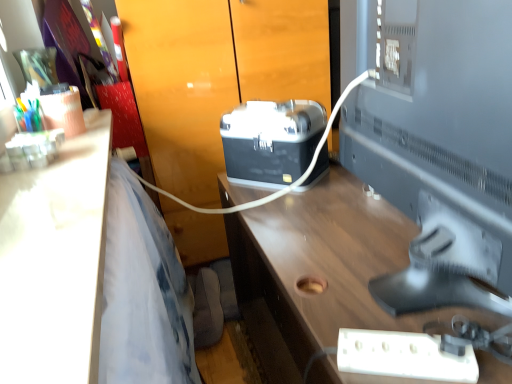
In order to click on free space above white glossy desk at left, the second desk viewed from the right (from a real-world perspective) in this screenshot , I will do `click(54, 190)`.